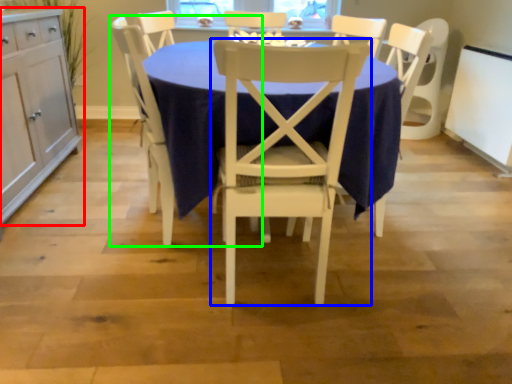
Question: Which object is positioned farthest from cabinetry (highlighted by a red box)? Select from chair (highlighted by a blue box) and chair (highlighted by a green box).

Choices:
 (A) chair
 (B) chair

Answer: (A)